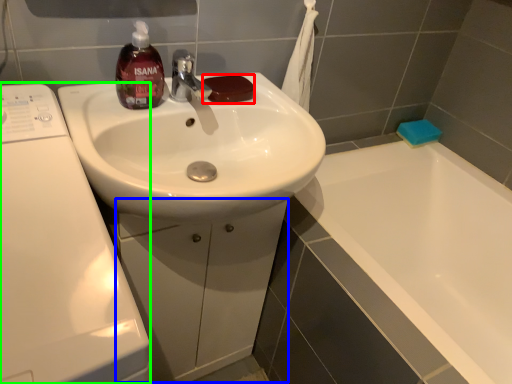
Question: Which object is the farthest from soap (highlighted by a red box)? Choose among these: drawer (highlighted by a blue box) or washing machine (highlighted by a green box).

Choices:
 (A) drawer
 (B) washing machine

Answer: (A)